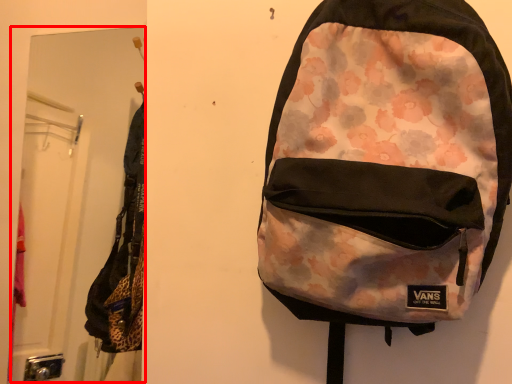
Question: Where is mirror (annotated by the red box) located in relation to backpack in the image?

Choices:
 (A) left
 (B) right

Answer: (A)